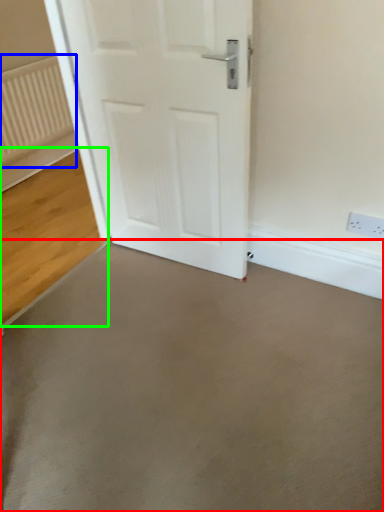
Question: Based on their relative distances, which object is nearer to concrete (highlighted by a red box)? Choose from radiator (highlighted by a blue box) and concrete (highlighted by a green box).

Choices:
 (A) radiator
 (B) concrete

Answer: (B)